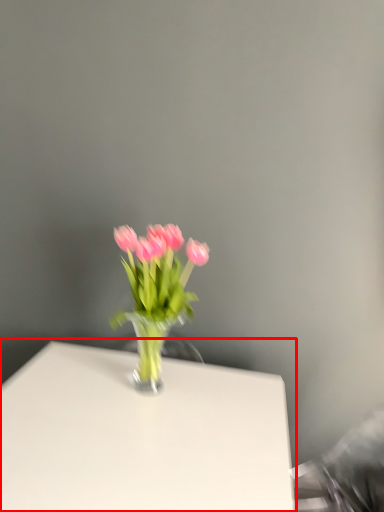
Question: Considering the relative positions of table (annotated by the red box) and floral arrangement in the image provided, where is table (annotated by the red box) located with respect to the staircase?

Choices:
 (A) right
 (B) left

Answer: (B)